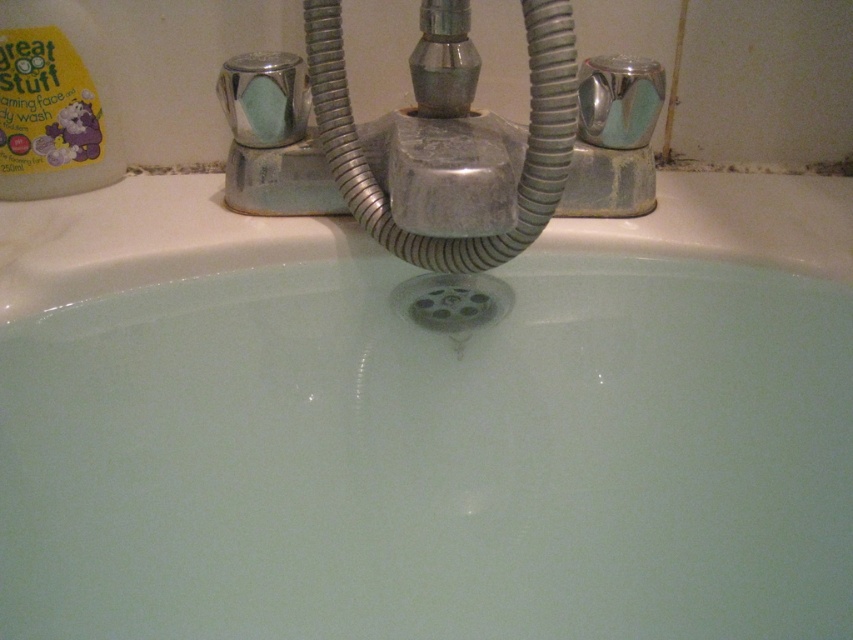
Question: Which point is closer to the camera taking this photo?

Choices:
 (A) (256, 132)
 (B) (527, 435)
 (C) (402, 170)

Answer: (C)

Question: Which of the following is the closest to the observer?

Choices:
 (A) (x=273, y=125)
 (B) (x=476, y=401)
 (C) (x=634, y=97)

Answer: (B)

Question: Which point is closer to the camera?

Choices:
 (A) (190, 209)
 (B) (271, 100)
 (C) (596, 131)

Answer: (B)

Question: Can you confirm if chrome/metallic faucet at center is bigger than matte green soap at upper center?

Choices:
 (A) yes
 (B) no

Answer: (A)

Question: Is white glossy bath at center positioned at the back of chrome/metallic faucet at center?

Choices:
 (A) yes
 (B) no

Answer: (A)

Question: Can you confirm if white glossy bath at center is positioned above matte green soap at upper center?

Choices:
 (A) no
 (B) yes

Answer: (A)